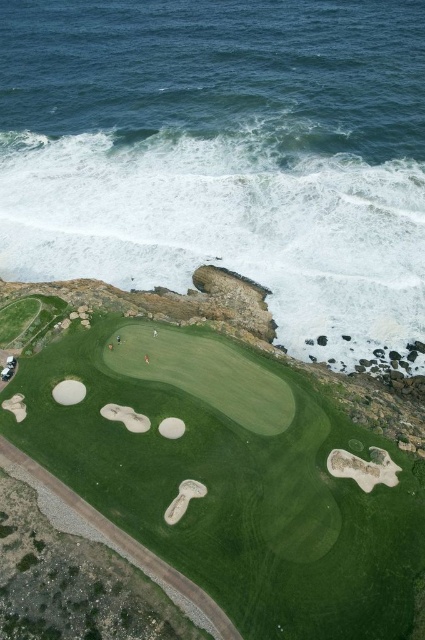
Question: Among these points, which one is nearest to the camera?

Choices:
 (A) (79, 385)
 (B) (252, 394)
 (C) (269, 308)

Answer: (B)

Question: Does green grassy golf course at center have a smaller size compared to white sand bunker at lower left?

Choices:
 (A) yes
 (B) no

Answer: (B)

Question: Which object is closer to the camera taking this photo?

Choices:
 (A) white foamy wave at upper center
 (B) white sand bunker at lower left
 (C) green grassy golf course at center

Answer: (C)

Question: Which of the following is the closest to the observer?

Choices:
 (A) white foamy wave at upper center
 (B) white sand bunker at lower left

Answer: (B)

Question: Is green grassy golf course at center further to the viewer compared to white sand bunker at lower left?

Choices:
 (A) yes
 (B) no

Answer: (B)

Question: Does white foamy wave at upper center have a smaller size compared to white sand bunker at lower left?

Choices:
 (A) no
 (B) yes

Answer: (A)